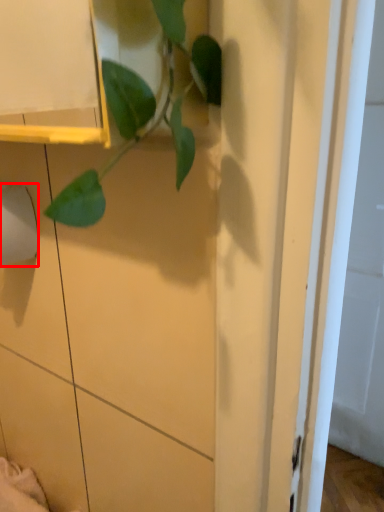
Question: From the image's perspective, considering the relative positions of toilet paper (annotated by the red box) and houseplant in the image provided, where is toilet paper (annotated by the red box) located with respect to the staircase?

Choices:
 (A) above
 (B) below

Answer: (B)